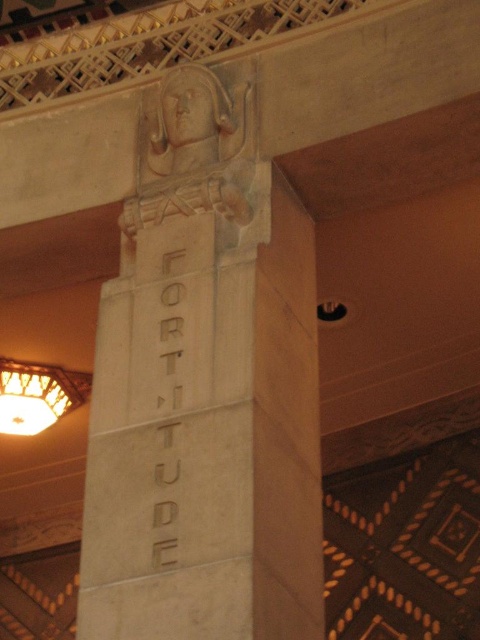
Which is more to the left, white stone relief at center or matte brass lampshade at left?

Positioned to the left is matte brass lampshade at left.

How distant is white stone relief at center from matte brass lampshade at left?

They are 17.67 meters apart.

Between point (181, 188) and point (12, 388), which one is positioned in front?

Point (181, 188) is more forward.

This screenshot has height=640, width=480. What are the coordinates of `white stone relief at center` in the screenshot? It's located at (192, 150).